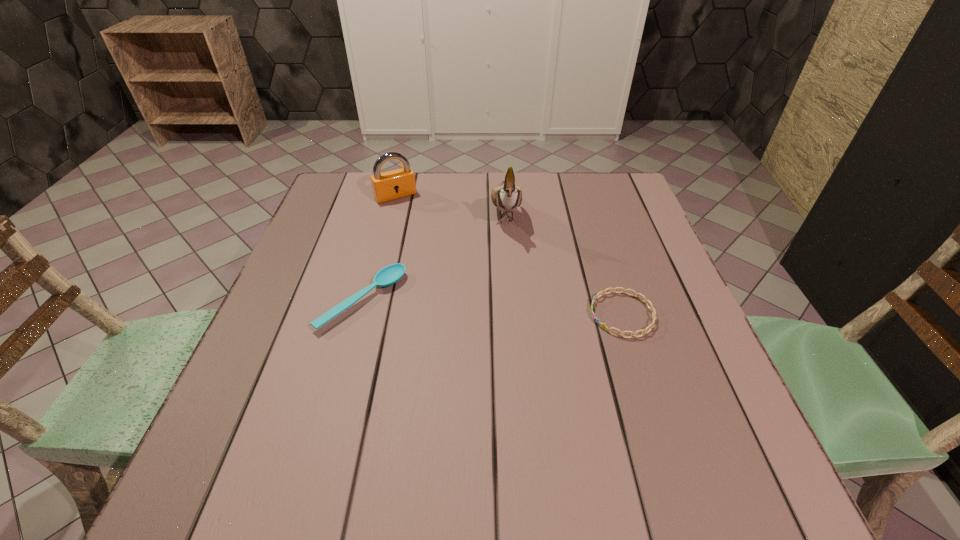
You are a GUI agent. You are given a task and a screenshot of the screen. Output one action in this format:
    pyautogui.click(x=<x>, y=<y>)
    Task: Click on the spoon
    
    Given the screenshot: What is the action you would take?
    tap(389, 275)

This screenshot has width=960, height=540. Identify the location of the rightmost object. (645, 300).

The image size is (960, 540). Identify the location of bird. (507, 197).

This screenshot has height=540, width=960. I want to click on the second object from right to left, so click(x=507, y=197).

This screenshot has width=960, height=540. Find the location of `padlock`. padlock is located at coordinates (394, 184).

This screenshot has width=960, height=540. In order to click on free spot located 0.130m on the front of the spoon in this screenshot , I will do `click(339, 389)`.

Locate an element on the screen. The height and width of the screenshot is (540, 960). vacant area situated 0.400m on the surface of the rightmost object showing star-shaped elements is located at coordinates (406, 314).

At what (x,y) coordinates should I click in order to perform the action: click on vacant region located on the surface of the rightmost object showing star-shaped elements. Please return your answer as a coordinate pair (x, y). The width and height of the screenshot is (960, 540). Looking at the image, I should click on (416, 314).

Find the location of `vacant space located 0.190m on the surface of the rightmost object showing star-shaped elements`. vacant space located 0.190m on the surface of the rightmost object showing star-shaped elements is located at coordinates (503, 314).

I want to click on vacant region located at the face of the tallest object, so click(x=512, y=285).